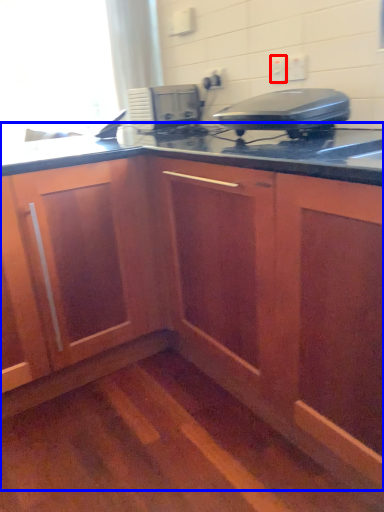
Question: Among these objects, which one is nearest to the camera, electric outlet (highlighted by a red box) or cabinetry (highlighted by a blue box)?

Choices:
 (A) electric outlet
 (B) cabinetry

Answer: (B)